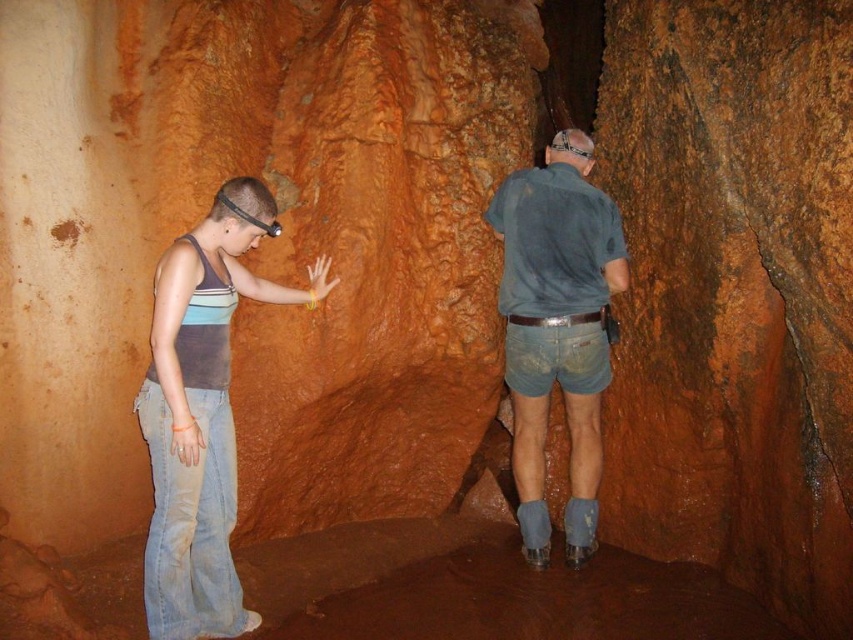
Question: Among these objects, which one is farthest from the camera?

Choices:
 (A) denim jeans at left
 (B) blue denim shorts at right

Answer: (B)

Question: Observing the image, what is the correct spatial positioning of denim jeans at left in reference to blue denim shorts at right?

Choices:
 (A) left
 (B) right

Answer: (A)

Question: Where is denim jeans at left located in relation to blue denim shorts at right in the image?

Choices:
 (A) left
 (B) right

Answer: (A)

Question: Which object appears closest to the camera in this image?

Choices:
 (A) denim jeans at left
 (B) blue denim shorts at right

Answer: (A)

Question: Is denim jeans at left closer to camera compared to blue denim shorts at right?

Choices:
 (A) no
 (B) yes

Answer: (B)